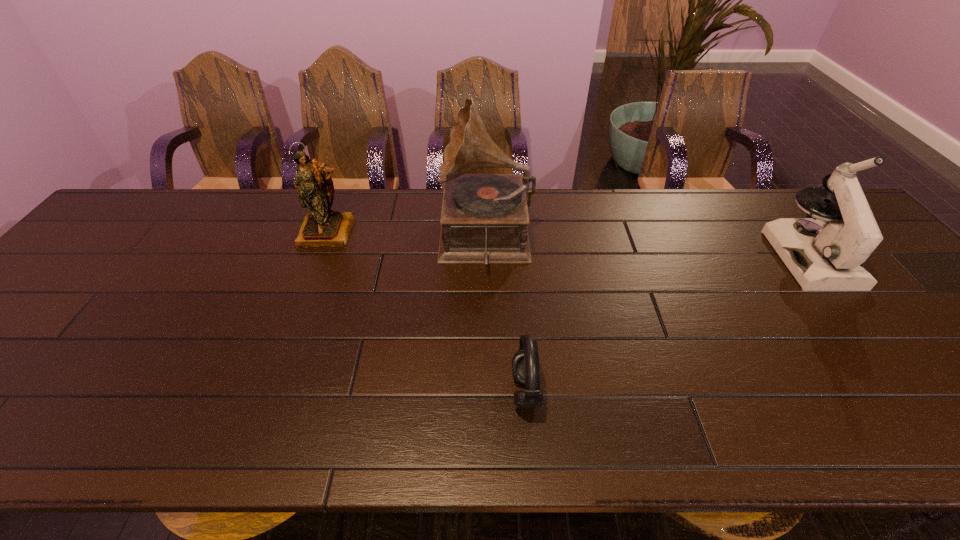
Where is `free location located on the earcups of the shortest object`? The height and width of the screenshot is (540, 960). free location located on the earcups of the shortest object is located at coordinates (412, 392).

Identify the location of free spot located 0.310m on the earcups of the shortest object. The height and width of the screenshot is (540, 960). (364, 392).

The image size is (960, 540). Find the location of `vacant space situated 0.230m on the earcups of the shortest object`. vacant space situated 0.230m on the earcups of the shortest object is located at coordinates (402, 392).

In order to click on record player that is at the far edge in this screenshot , I will do `click(484, 217)`.

Find the location of `microscope situated at the far edge`. microscope situated at the far edge is located at coordinates pyautogui.click(x=824, y=252).

What are the coordinates of `figurine that is at the far edge` in the screenshot? It's located at (322, 227).

Find the location of `object positioned at the near edge`. object positioned at the near edge is located at coordinates (525, 364).

Image resolution: width=960 pixels, height=540 pixels. Find the location of `object that is at the right edge`. object that is at the right edge is located at coordinates (824, 252).

Locate an element on the screen. This screenshot has width=960, height=540. object at the far right corner is located at coordinates (824, 252).

You are a GUI agent. You are given a task and a screenshot of the screen. Output one action in this format:
    pyautogui.click(x=<x>, y=<y>)
    Task: Click on the vacant space at the far edge of the desktop
    The height and width of the screenshot is (540, 960).
    Given the screenshot: What is the action you would take?
    pyautogui.click(x=685, y=237)